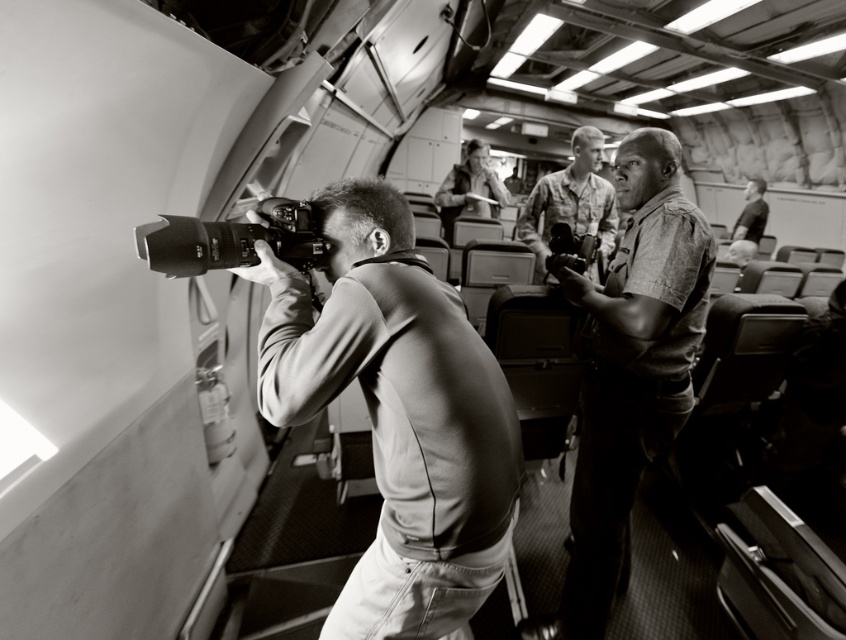
You are a photographer trying to reach your metallic silver camera at center without disturbing the person in the camouflage uniform at center. Can you move forward towards the camera?

The metallic silver camera at center is closer to the viewer than the camouflage uniform at center, so yes, you can move forward towards the metallic silver camera at center without disturbing the person in the camouflage uniform at center since it is further away.

You are a photographer trying to capture a closeup of the metallic camera at center without moving it. The textured military uniform at center is blocking your view. What is the minimum distance you need to move backward to ensure the uniform is no longer in the frame?

The minimum distance to move backward would depend on the camera lens focal length and sensor size. However, since the objects are 48.53 centimeters apart, moving back at least 48.53 centimeters might help, but this is an approximation and actual distance may vary based on equipment.

What is the point at coordinate (630, 369) located on in the scene?

The point at coordinate (630, 369) is located on the textured military uniform at center.